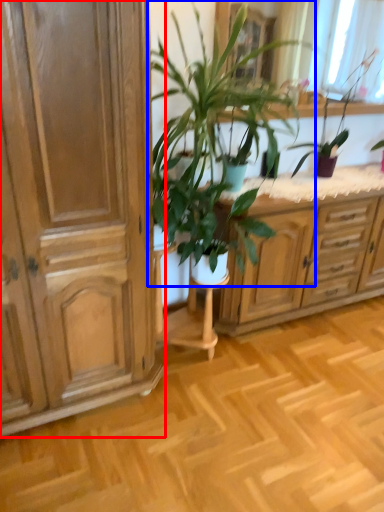
Question: Which object appears farthest to the camera in this image, cabinetry (highlighted by a red box) or houseplant (highlighted by a blue box)?

Choices:
 (A) cabinetry
 (B) houseplant

Answer: (B)